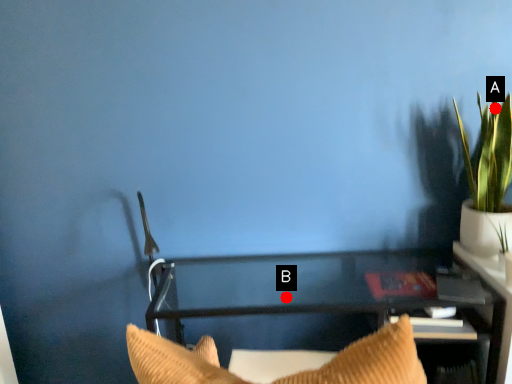
Question: Two points are circled on the image, labeled by A and B beside each circle. Which point is closer to the camera taking this photo?

Choices:
 (A) A is closer
 (B) B is closer

Answer: (A)